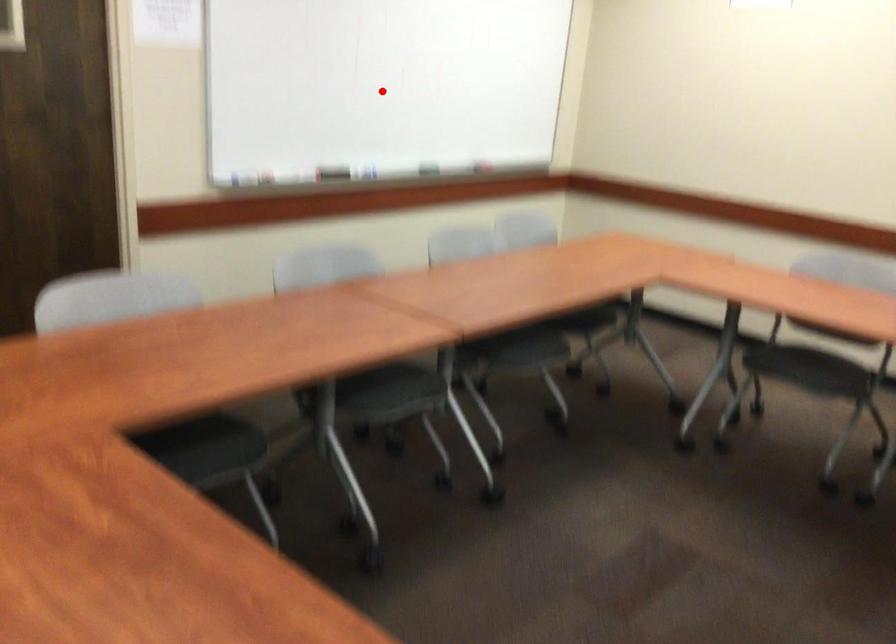
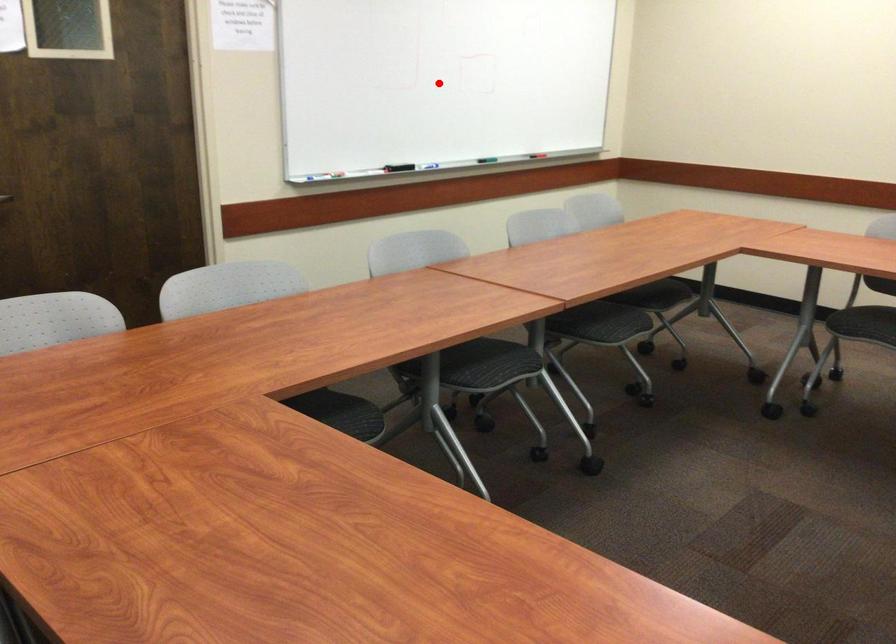
From the picture: I am providing you with two images of the same scene from different viewpoints. A red point is marked on the first image and another point is marked on the second image. Are the points marked in image1 and image2 representing the same 3D position?

Yes